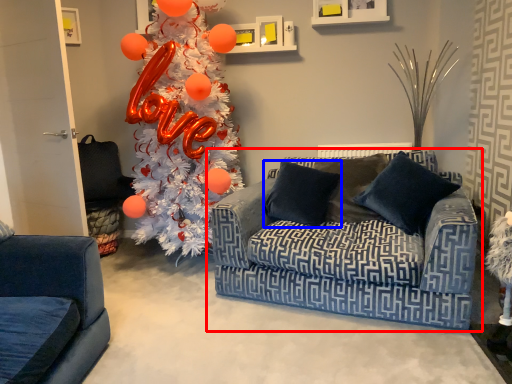
Question: Which object is further to the camera taking this photo, studio couch (highlighted by a red box) or pillow (highlighted by a blue box)?

Choices:
 (A) studio couch
 (B) pillow

Answer: (B)